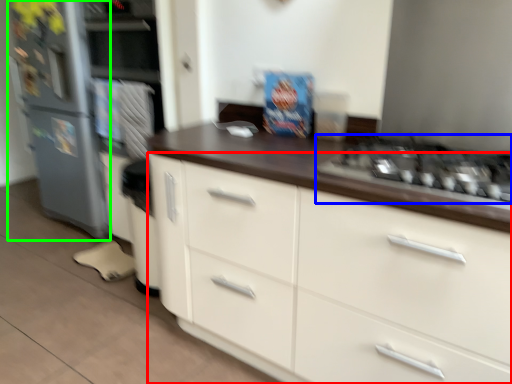
Question: Considering the real-world distances, which object is farthest from cabinetry (highlighted by a red box)? gas stove (highlighted by a blue box) or refrigerator (highlighted by a green box)?

Choices:
 (A) gas stove
 (B) refrigerator

Answer: (B)